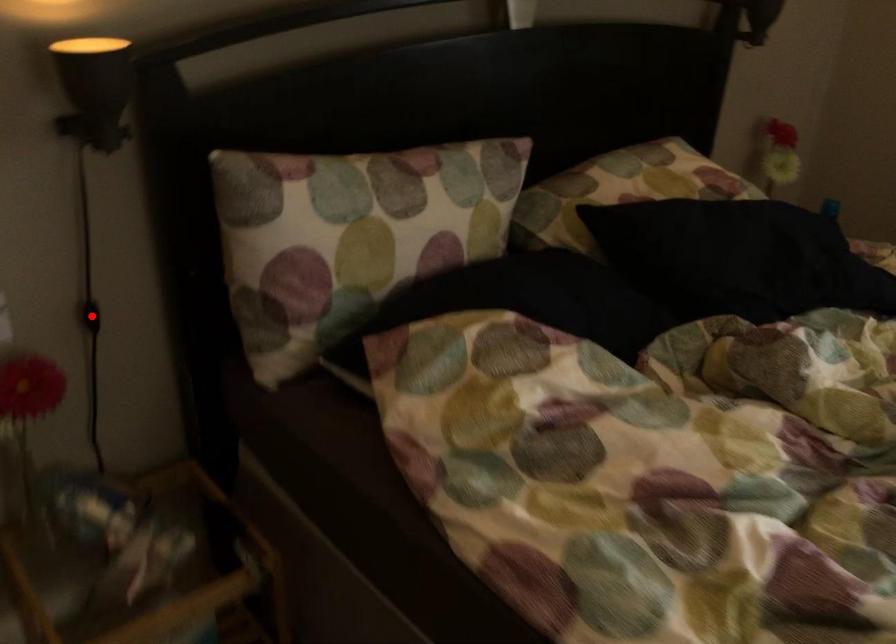
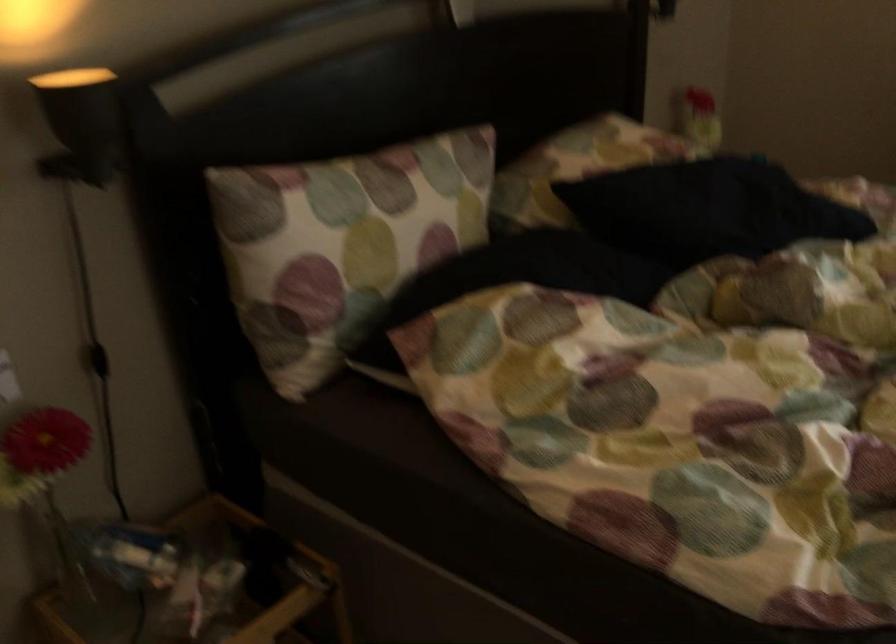
In the second image, find the point that corresponds to the highlighted location in the first image.

(98, 360)